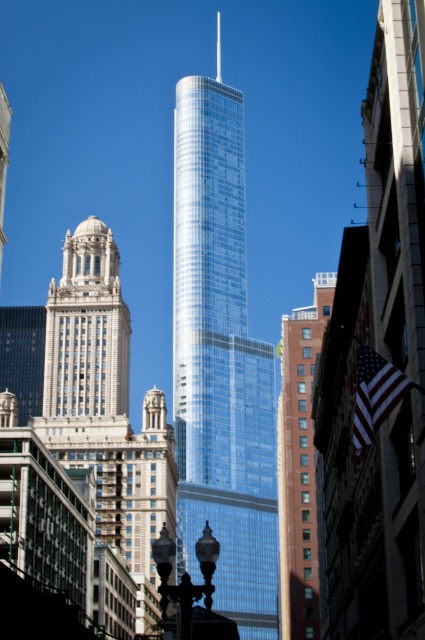
You are standing at the center of the image and want to locate the white stone tower at left. Based on the coordinates provided, in which direction should you look to find it?

The white stone tower at left is located at coordinates point (x=105, y=406), which means it is positioned to the left side of the image. Therefore, you should look to your left to find it.

You are standing in front of the skyscraper and want to take a photo that includes both the modern skyscraper and the historic building to its left. You notice two points marked on your camera screen at coordinates point (164, 513) and point (303, 584). Which point is closer to you, the photographer?

Point (164, 513) is closer to you than point (303, 584) because it is further to the camera.